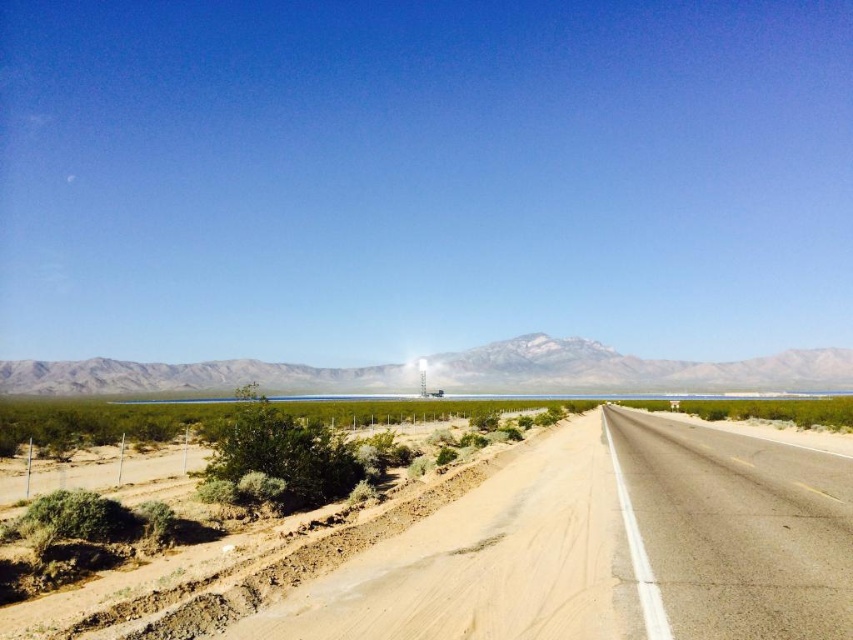
Question: In this image, where is asphalt road at center located relative to green shrubbery at lower left?

Choices:
 (A) above
 (B) below

Answer: (A)

Question: Among these points, which one is farthest from the camera?

Choices:
 (A) (366, 540)
 (B) (434, 541)
 (C) (796, 636)
 (D) (230, 371)

Answer: (D)

Question: Does asphalt road at center have a larger size compared to gray rocky mountain at center?

Choices:
 (A) yes
 (B) no

Answer: (B)

Question: Which object appears farthest from the camera in this image?

Choices:
 (A) gray rocky mountain at center
 (B) asphalt road at right
 (C) green shrubbery at lower left
 (D) asphalt road at center

Answer: (A)

Question: Which point is farther to the camera?

Choices:
 (A) (148, 364)
 (B) (837, 481)

Answer: (A)

Question: Does asphalt road at right have a smaller size compared to gray rocky mountain at center?

Choices:
 (A) yes
 (B) no

Answer: (A)